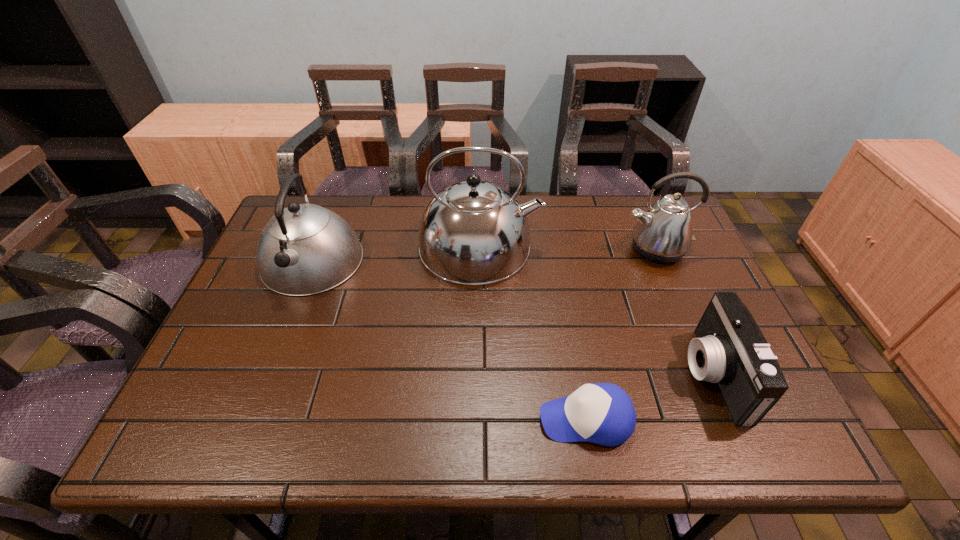
Identify which object is located as the nearest to the rightmost kettle. Please provide its 2D coordinates. Your answer should be formatted as a tuple, i.e. [(x, y)], where the tuple contains the x and y coordinates of a point satisfying the conditions above.

[(730, 350)]

Identify which kettle is the closest to the leftmost kettle. Please provide its 2D coordinates. Your answer should be formatted as a tuple, i.e. [(x, y)], where the tuple contains the x and y coordinates of a point satisfying the conditions above.

[(473, 233)]

Where is `kettle that is the second nearest to the rightmost kettle`? Image resolution: width=960 pixels, height=540 pixels. kettle that is the second nearest to the rightmost kettle is located at coordinates (305, 249).

Locate an element on the screen. The image size is (960, 540). free space that satisfies the following two spatial constraints: 1. from the spout of the rightmost kettle; 2. on the right side of the tallest kettle is located at coordinates (480, 249).

Where is `vacant region that satisfies the following two spatial constraints: 1. on the front side of the rightmost kettle; 2. on the front-facing side of the baseball cap`? This screenshot has height=540, width=960. vacant region that satisfies the following two spatial constraints: 1. on the front side of the rightmost kettle; 2. on the front-facing side of the baseball cap is located at coordinates (728, 419).

At what (x,y) coordinates should I click in order to perform the action: click on vacant position in the image that satisfies the following two spatial constraints: 1. from the spout of the tallest kettle; 2. on the right side of the rightmost kettle. Please return your answer as a coordinate pair (x, y). The image size is (960, 540). Looking at the image, I should click on (480, 249).

Locate an element on the screen. The height and width of the screenshot is (540, 960). free point that satisfies the following two spatial constraints: 1. from the spout of the second kettle from left to right; 2. from the spout of the leftmost object is located at coordinates (480, 261).